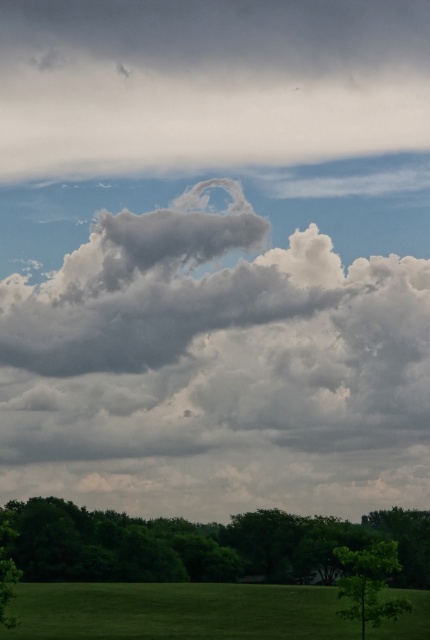
Question: Considering the real-world distances, which object is farthest from the gray fluffy cloud at upper center?

Choices:
 (A) green leafy tree at lower right
 (B) green leafy tree at lower left

Answer: (A)

Question: Is cloudy white at upper center closer to camera compared to green leafy tree at lower right?

Choices:
 (A) no
 (B) yes

Answer: (A)

Question: Among these points, which one is farthest from the camera?

Choices:
 (A) (409, 296)
 (B) (70, 529)
 (C) (421, 605)
 (D) (337, 112)

Answer: (D)

Question: Which object is the closest to the green leafy tree at lower right?

Choices:
 (A) gray fluffy cloud at upper center
 (B) green grass at bottom
 (C) green leafy tree at lower center
 (D) green leafy tree at lower left

Answer: (D)

Question: Does gray fluffy cloud at upper center appear on the left side of green leafy tree at lower center?

Choices:
 (A) no
 (B) yes

Answer: (B)

Question: Does green leafy tree at lower right appear under green leafy tree at lower left?

Choices:
 (A) no
 (B) yes

Answer: (B)